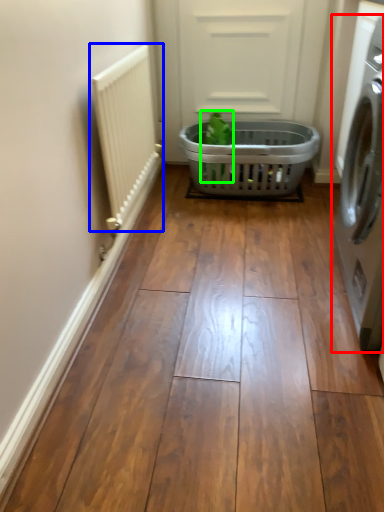
Question: Estimate the real-world distances between objects in this image. Which object is farther from washing machine (highlighted by a red box), radiator (highlighted by a blue box) or plant (highlighted by a green box)?

Choices:
 (A) radiator
 (B) plant

Answer: (B)